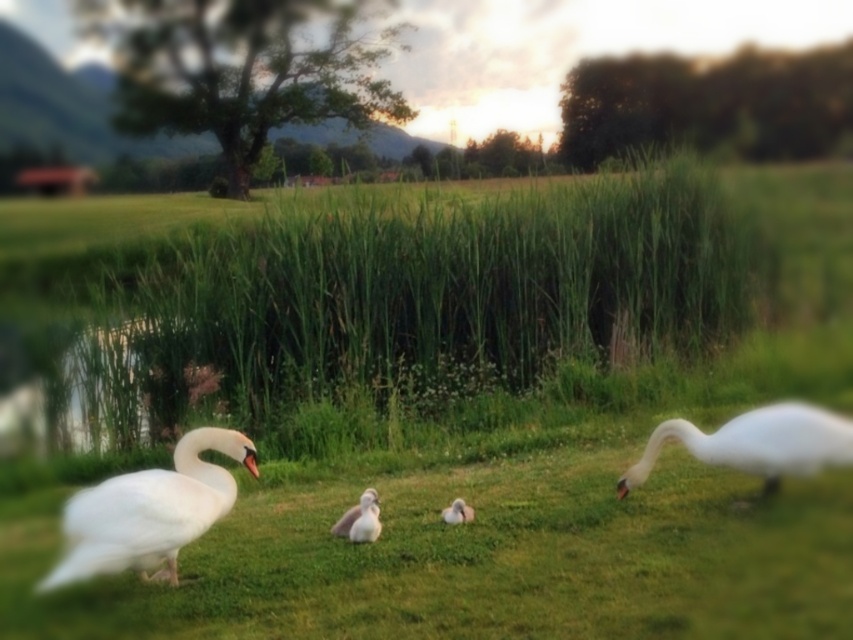
Question: Is white glossy swan at left smaller than white feathered goose at center?

Choices:
 (A) no
 (B) yes

Answer: (A)

Question: Which of the following is the closest to the observer?

Choices:
 (A) (457, 518)
 (B) (654, 442)
 (C) (364, 509)

Answer: (C)

Question: Does white glossy swan at left appear on the right side of white fluffy duckling at center?

Choices:
 (A) no
 (B) yes

Answer: (A)

Question: Which object is farther from the camera taking this photo?

Choices:
 (A) white fluffy duckling at center
 (B) white glossy swan at right
 (C) white smooth duckling at center
 (D) white feathered goose at center

Answer: (A)

Question: Among these points, which one is nearest to the camera?

Choices:
 (A) (454, 506)
 (B) (376, 525)

Answer: (B)

Question: Is white glossy swan at left to the right of white fluffy duckling at center from the viewer's perspective?

Choices:
 (A) yes
 (B) no

Answer: (B)